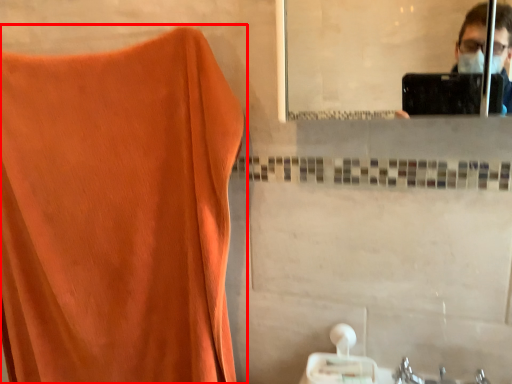
Question: From the image's perspective, what is the correct spatial relationship of curtain (annotated by the red box) in relation to tissue?

Choices:
 (A) below
 (B) above

Answer: (B)